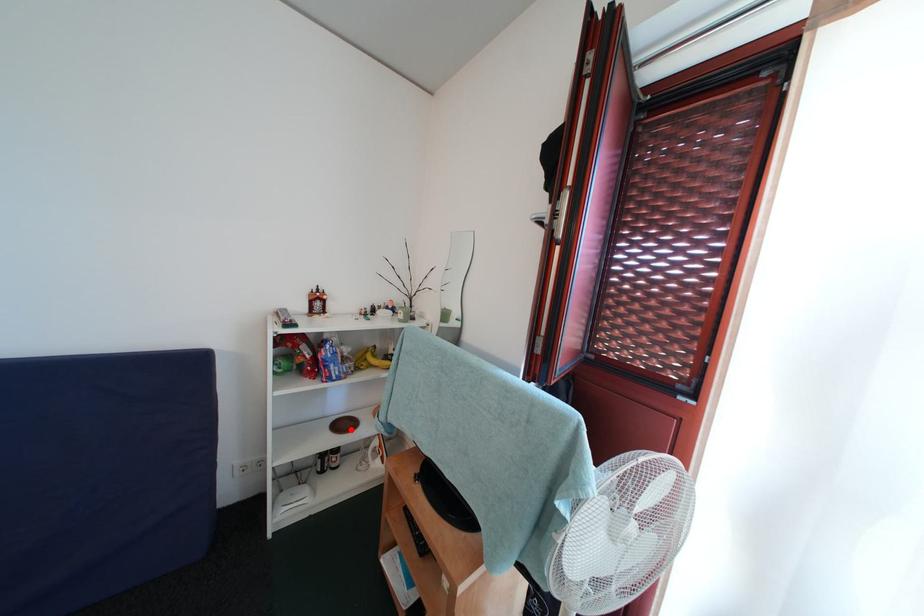
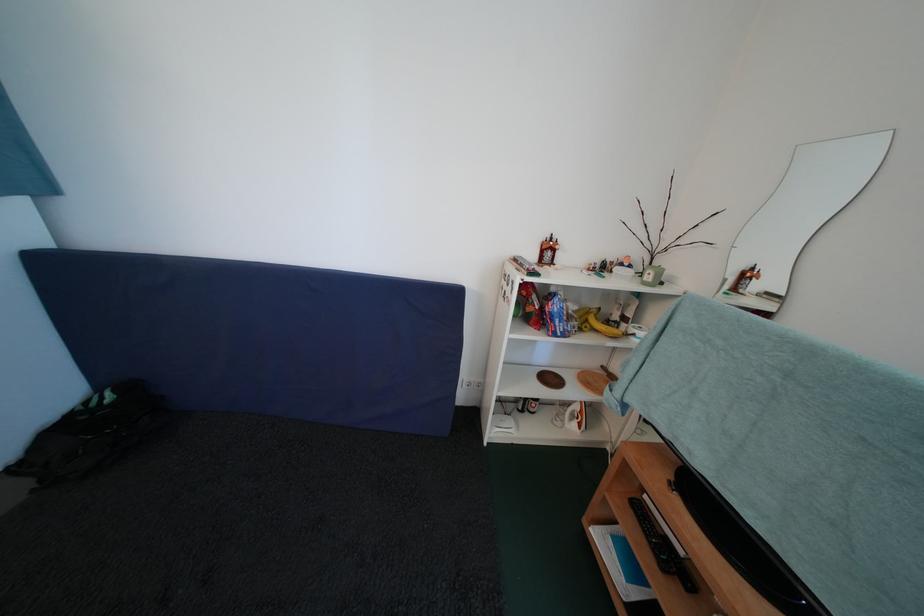
Question: I am providing you with two images of the same scene from different viewpoints. A red point is marked on the first image. Can you still see the location of the red point in image 2?

Choices:
 (A) Yes
 (B) No

Answer: (A)